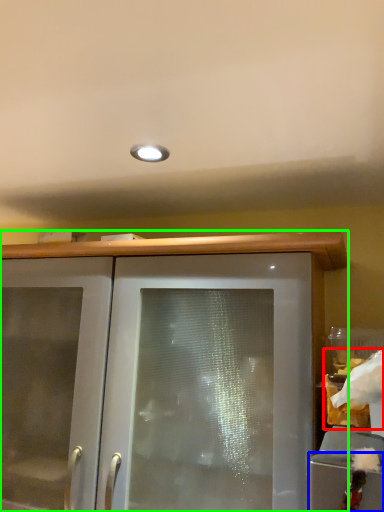
Question: Based on their relative distances, which object is farther from food (highlighted by a red box)? Choose from cabinetry (highlighted by a blue box) and cabinetry (highlighted by a green box).

Choices:
 (A) cabinetry
 (B) cabinetry

Answer: (B)